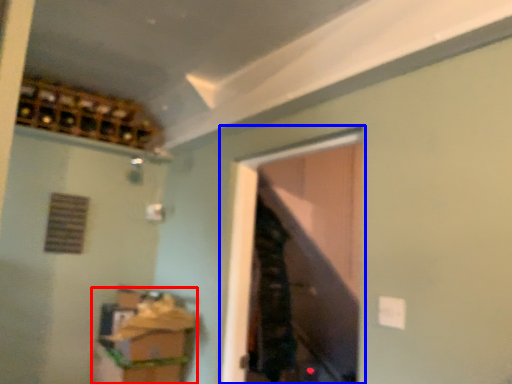
Question: Among these objects, which one is farthest to the camera, cabinetry (highlighted by a red box) or window (highlighted by a blue box)?

Choices:
 (A) cabinetry
 (B) window

Answer: (A)